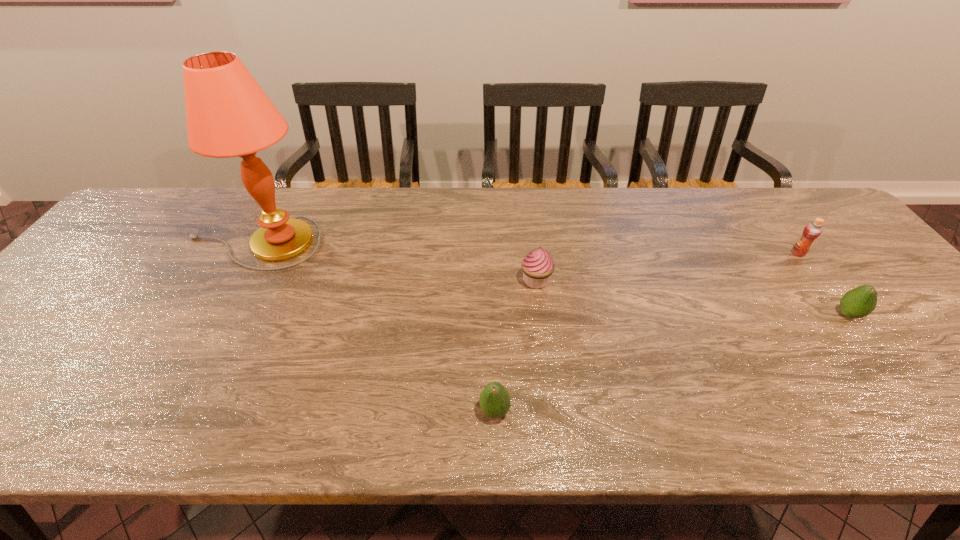
Locate which object ranks in proximity to the farther avocado. Please provide its 2D coordinates. Your answer should be formatted as a tuple, i.e. [(x, y)], where the tuple contains the x and y coordinates of a point satisfying the conditions above.

[(812, 230)]

At what (x,y) coordinates should I click in order to perform the action: click on the fourth closest object to the third object from right to left. Please return your answer as a coordinate pair (x, y). The image size is (960, 540). Looking at the image, I should click on (812, 230).

Find the location of `free location that satisfies the following two spatial constraints: 1. on the back side of the nearest object; 2. on the left side of the orange juice`. free location that satisfies the following two spatial constraints: 1. on the back side of the nearest object; 2. on the left side of the orange juice is located at coordinates (491, 253).

Image resolution: width=960 pixels, height=540 pixels. I want to click on free space that satisfies the following two spatial constraints: 1. on the back side of the second object from left to right; 2. on the left side of the right avocado, so click(492, 314).

The height and width of the screenshot is (540, 960). Find the location of `vacant space that satisfies the following two spatial constraints: 1. on the front side of the right avocado; 2. on the left side of the third object from left to right`. vacant space that satisfies the following two spatial constraints: 1. on the front side of the right avocado; 2. on the left side of the third object from left to right is located at coordinates (540, 314).